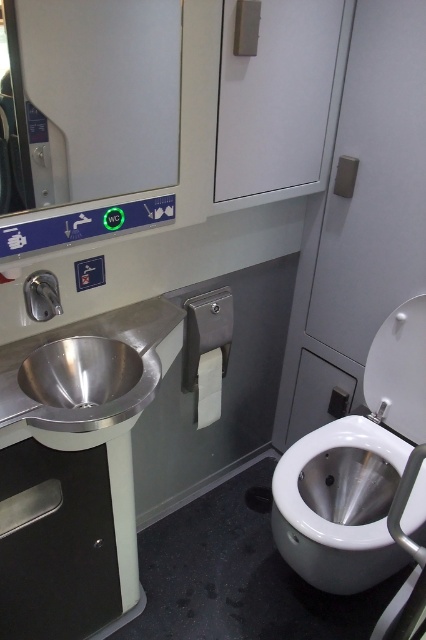
You are a maintenance worker checking the restroom facilities. You need to clean both the white glossy toilet bowl at lower right and the polished stainless steel sink at left. Which one should you clean first if you want to start with the one closer to you?

You should clean the white glossy toilet bowl at lower right first because it is closer to you than the polished stainless steel sink at left according to the description.

You are a maintenance worker tasked with installing a new sensor for hand sanitizer between the white glossy toilet bowl at lower right and the polished stainless steel sink at left. The sensor requires a minimum of 30 inches of space to function properly. Based on the image, can you determine if there is enough space between them to install the sensor?

The distance between the white glossy toilet bowl at lower right and the polished stainless steel sink at left is 27.33 inches, which is less than the required 30 inches. Therefore, there is not enough space to install the sensor properly.

You are a maintenance worker inspecting the restroom. You need to clean both the white glossy toilet bowl at lower right and the polished stainless steel sink at left. Which one should you clean first if you want to start from the top?

You should clean the polished stainless steel sink at left first because the white glossy toilet bowl at lower right is positioned under it, meaning the sink is higher up.